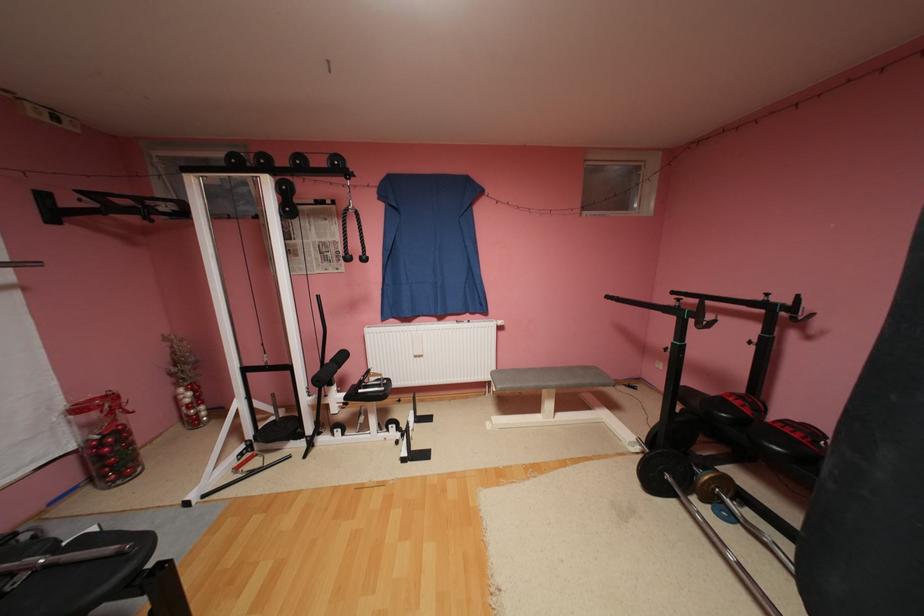
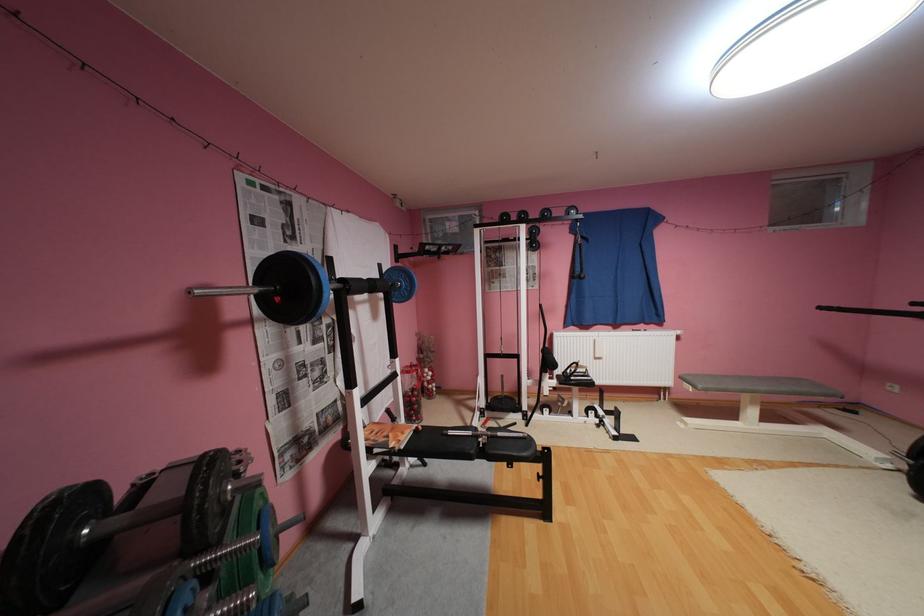
The point at (548, 411) is marked in the first image. Where is the corresponding point in the second image?

(746, 419)